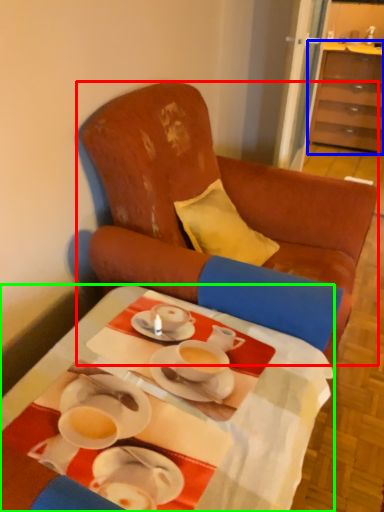
Question: Estimate the real-world distances between objects in this image. Which object is farther from chair (highlighted by a red box), cabinetry (highlighted by a blue box) or desk (highlighted by a green box)?

Choices:
 (A) cabinetry
 (B) desk

Answer: (A)